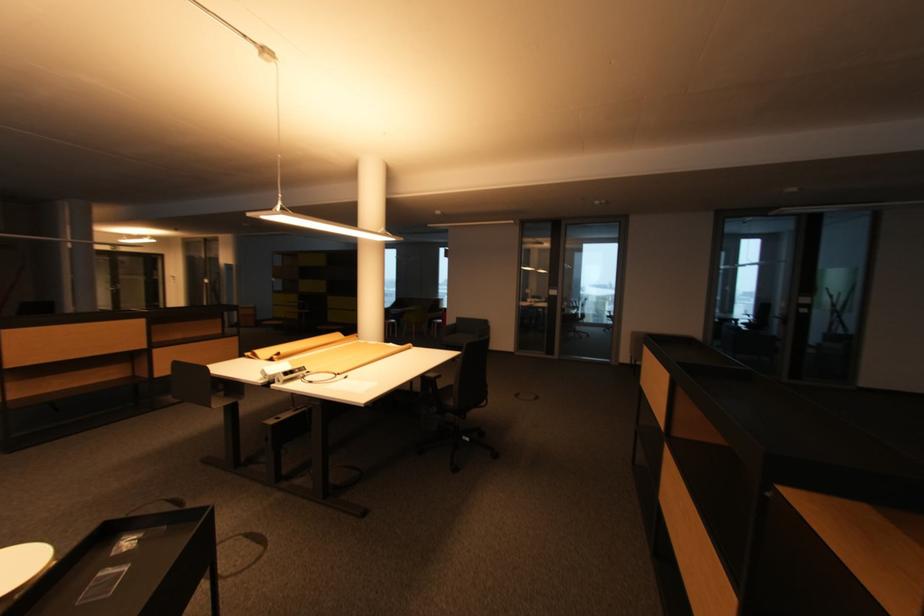
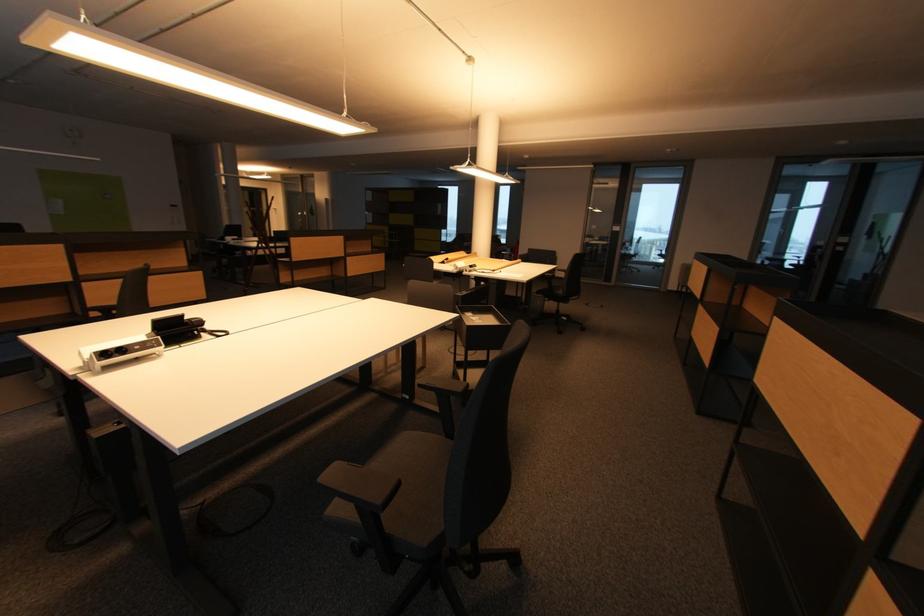
The images are taken continuously from a first-person perspective. In which direction are you moving?

The cameraman walked toward left, backward.